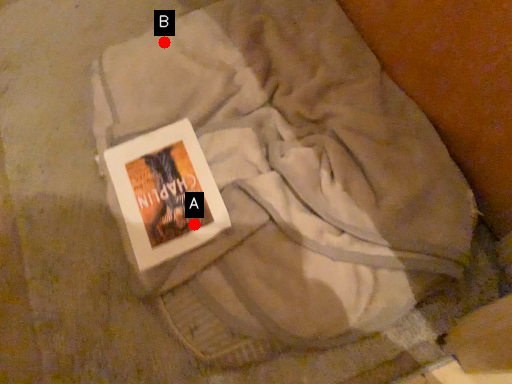
Question: Two points are circled on the image, labeled by A and B beside each circle. Which point is further to the camera?

Choices:
 (A) A is further
 (B) B is further

Answer: (B)